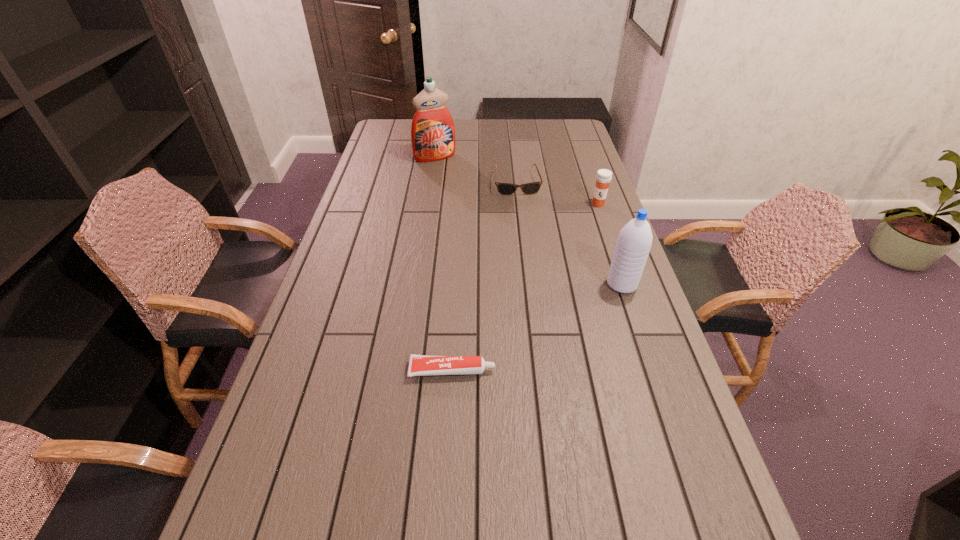
This screenshot has width=960, height=540. Identify the location of the shortest object. (419, 365).

Locate an element on the screen. This screenshot has height=540, width=960. toothpaste is located at coordinates 419,365.

The height and width of the screenshot is (540, 960). Find the location of `the fourth shortest object`. the fourth shortest object is located at coordinates (634, 242).

Locate an element on the screen. the fourth farthest object is located at coordinates (634, 242).

At what (x,y) coordinates should I click in order to perform the action: click on the fourth tallest object. Please return your answer as a coordinate pair (x, y). Looking at the image, I should click on (531, 188).

The width and height of the screenshot is (960, 540). Find the location of `sunglasses`. sunglasses is located at coordinates (531, 188).

You are a GUI agent. You are given a task and a screenshot of the screen. Output one action in this format:
    pyautogui.click(x=<x>, y=<y>)
    Task: Click on the third nearest object
    The width and height of the screenshot is (960, 540).
    Given the screenshot: What is the action you would take?
    pyautogui.click(x=603, y=178)

The height and width of the screenshot is (540, 960). I want to click on medicine, so click(x=603, y=178).

In order to click on the tallest object in this screenshot , I will do `click(432, 132)`.

The image size is (960, 540). What are the coordinates of `the farthest object` in the screenshot? It's located at (432, 132).